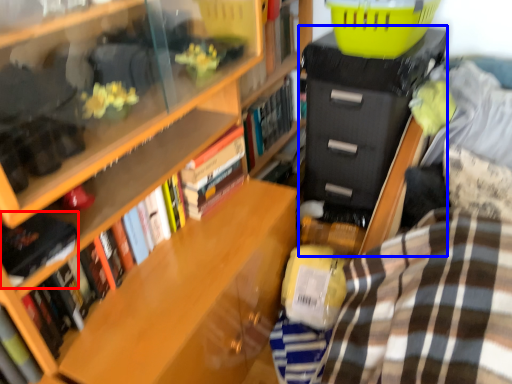
Question: Which object appears farthest to the camera in this image, book (highlighted by a red box) or file cabinet (highlighted by a blue box)?

Choices:
 (A) book
 (B) file cabinet

Answer: (B)